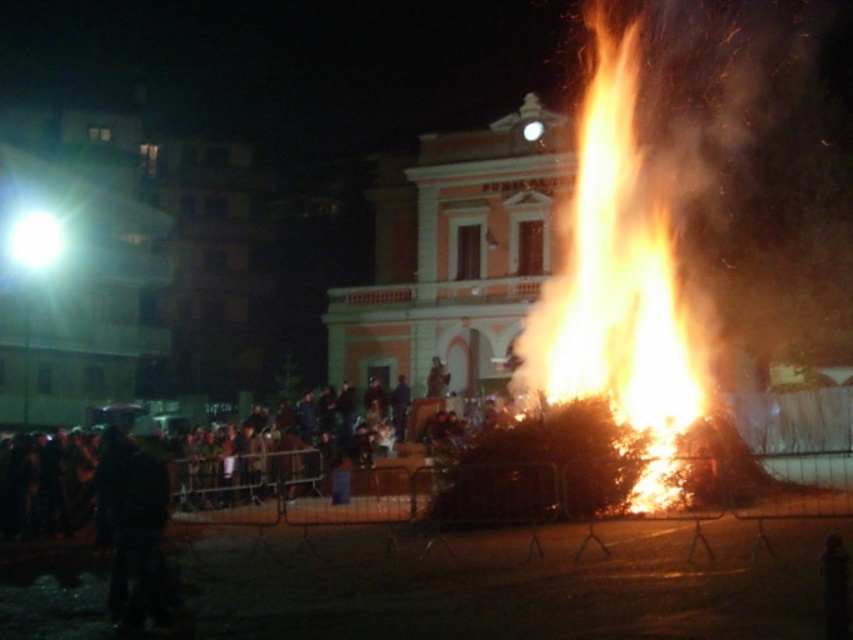
You are a fire safety officer inspecting the scene. You notice the flaming wood at center and the dark clothing crowd at lower left. Based on their positions, is there a risk of the crowd being exposed to falling debris from the fire?

The flaming wood at center is positioned over dark clothing crowd at lower left, so there is a risk of the crowd being exposed to falling debris from the fire.

You are standing at the edge of the event area and see the flaming wood at center. The safety regulations state that you must stay at least 200 feet away from any active flames. Are you compliant with the safety regulations?

The flaming wood at center is 204.96 feet away from the viewer, which exceeds the minimum required distance of 200 feet. Therefore, you are compliant with the safety regulations.